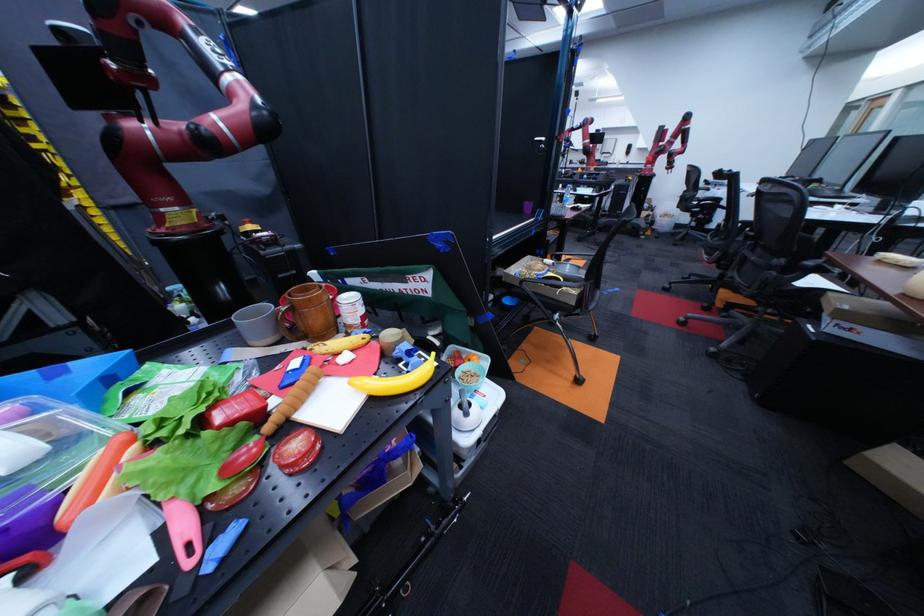
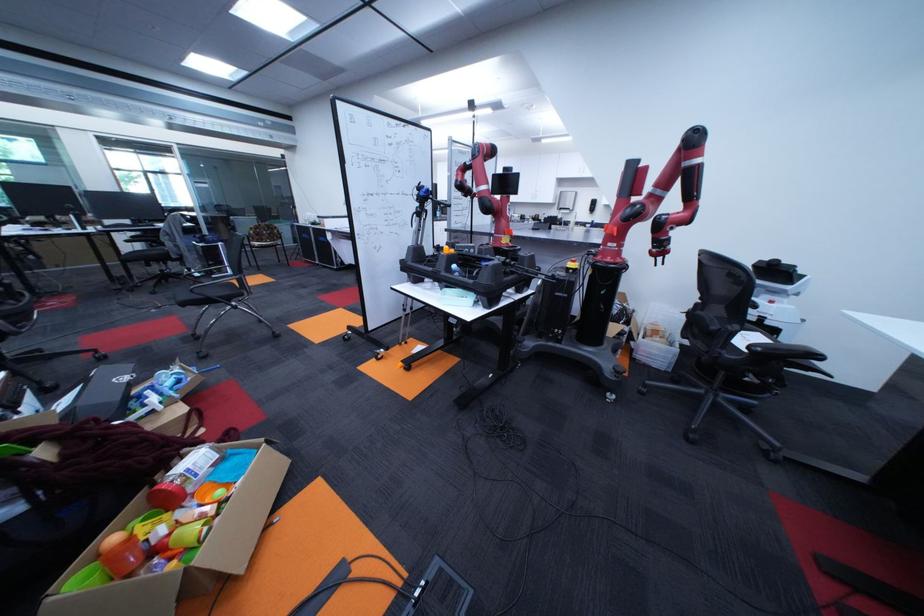
From the picture: Which direction would the cameraman need to move to produce the second image?

The cameraman moved toward right, forward.